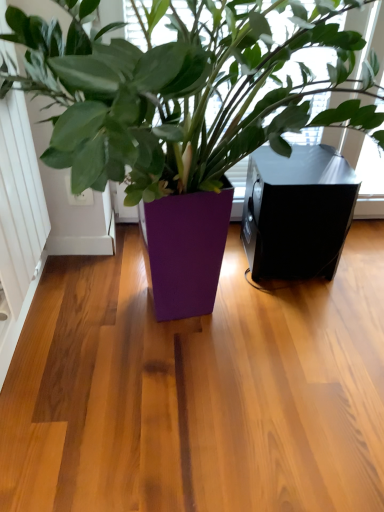
You are a GUI agent. You are given a task and a screenshot of the screen. Output one action in this format:
    pyautogui.click(x=<x>, y=<y>)
    Task: Click on the free spot below purple glossy planter at center (from a real-world perspective)
    The image size is (384, 512).
    Given the screenshot: What is the action you would take?
    pyautogui.click(x=226, y=336)